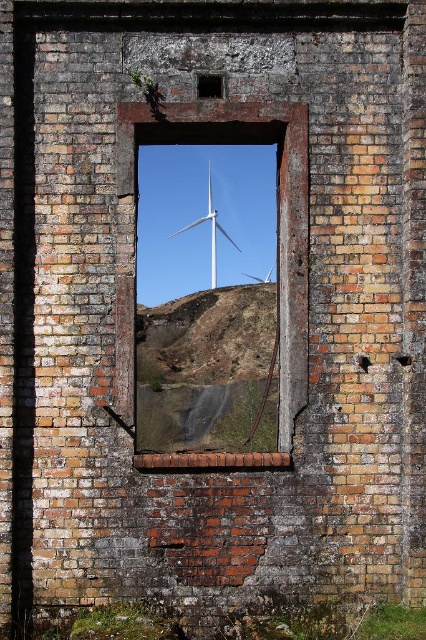
Which is above, brick at center or white matte wind turbine at center?

white matte wind turbine at center

Is point (301, 128) positioned before point (210, 228)?

That is True.

Image resolution: width=426 pixels, height=640 pixels. I want to click on brick at center, so click(278, 236).